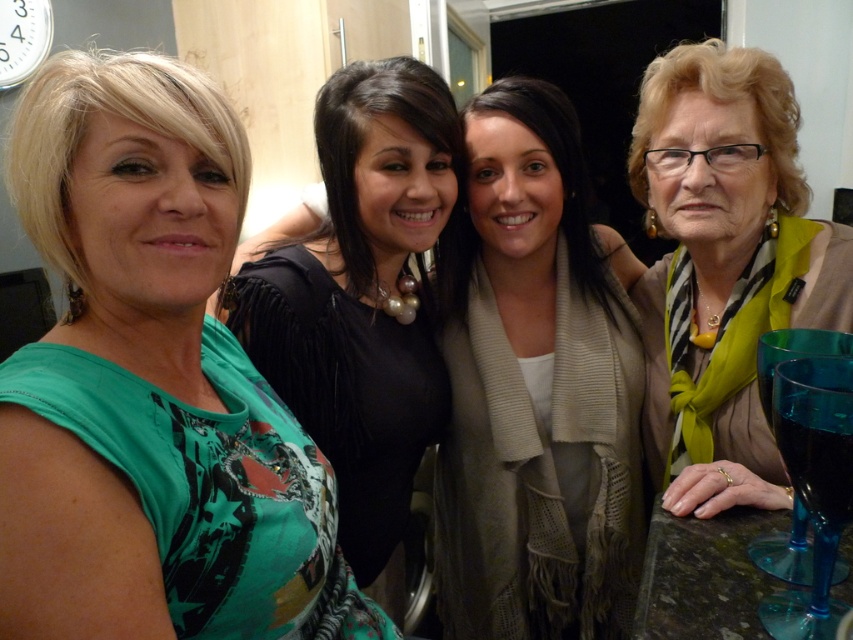
Question: Does light beige scarf at center come in front of green silk scarf at right?

Choices:
 (A) no
 (B) yes

Answer: (A)

Question: Does black matte dress at center appear on the left side of transparent blue wine glass at lower right?

Choices:
 (A) no
 (B) yes

Answer: (B)

Question: Which object is the closest to the green printed dress at left?

Choices:
 (A) transparent blue wine glass at lower right
 (B) black matte dress at center
 (C) green silk scarf at right
 (D) light beige scarf at center

Answer: (B)

Question: Which object appears closest to the camera in this image?

Choices:
 (A) light beige scarf at center
 (B) green silk scarf at right

Answer: (B)

Question: Which is farther from the green silk scarf at right?

Choices:
 (A) light beige scarf at center
 (B) black matte dress at center

Answer: (B)

Question: Can you confirm if green printed dress at left is positioned to the left of black matte dress at center?

Choices:
 (A) yes
 (B) no

Answer: (A)